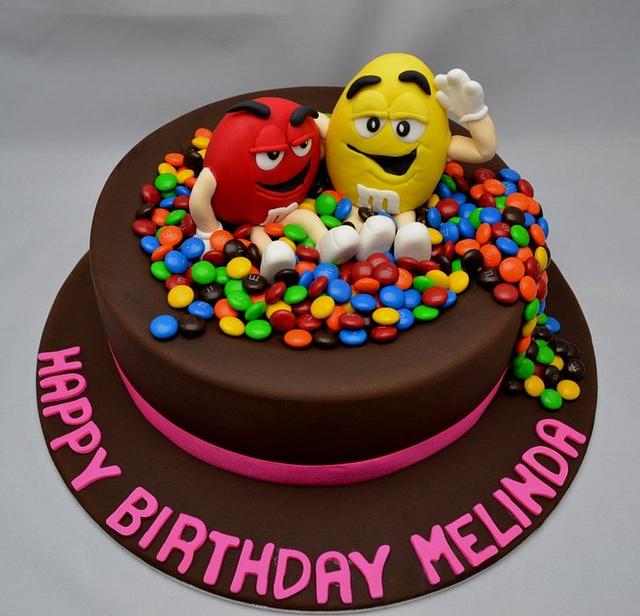
Where is `birthday cake`? This screenshot has height=616, width=640. birthday cake is located at coordinates (362, 385).